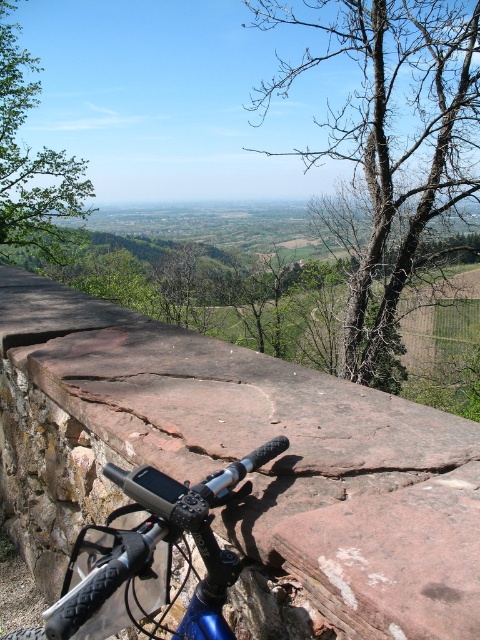
Question: Is reddish-brown stone at center thinner than blue metallic bicycle handlebar at center?

Choices:
 (A) no
 (B) yes

Answer: (A)

Question: Which object appears farthest from the camera in this image?

Choices:
 (A) blue metallic bicycle handlebar at center
 (B) bare wood tree at upper right
 (C) green leafy tree at upper left

Answer: (C)

Question: Considering the relative positions of blue metallic bicycle handlebar at center and green leafy tree at upper left in the image provided, where is blue metallic bicycle handlebar at center located with respect to green leafy tree at upper left?

Choices:
 (A) above
 (B) below

Answer: (B)

Question: Which object is positioned farthest from the green leafy tree at upper left?

Choices:
 (A) bare wood tree at upper right
 (B) reddish-brown stone at center
 (C) blue metallic bicycle handlebar at center

Answer: (C)

Question: Estimate the real-world distances between objects in this image. Which object is farther from the bare wood tree at upper right?

Choices:
 (A) blue metallic bicycle handlebar at center
 (B) reddish-brown stone at center
 (C) green leafy tree at upper left

Answer: (A)

Question: Considering the relative positions of reddish-brown stone at center and bare wood tree at upper right in the image provided, where is reddish-brown stone at center located with respect to bare wood tree at upper right?

Choices:
 (A) right
 (B) left

Answer: (B)